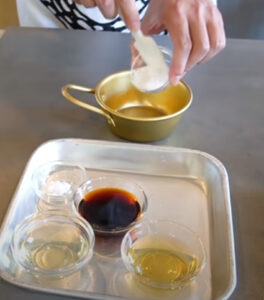
I want to click on clear cup to hold liquid, so click(28, 231), click(65, 167), click(112, 181), click(168, 231).